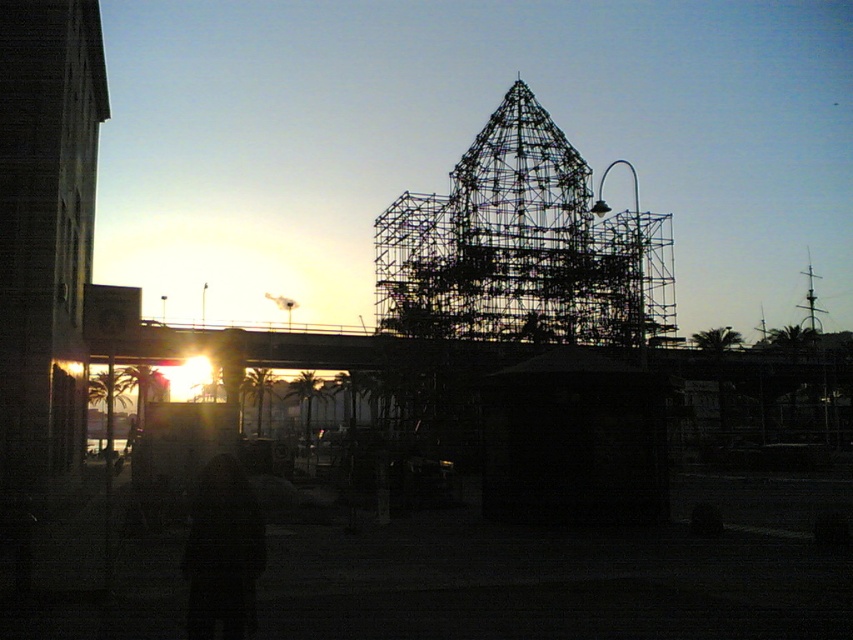
You are a photographer trying to capture the sunset through the metallic scaffolding at center and the dark fabric coat at lower center. Which object will block more of the sunset view due to its size?

The metallic scaffolding at center is bigger than the dark fabric coat at lower center, so it will block more of the sunset view.

You are standing on the bridge in the midground and want to walk to the metallic scaffolding at center and the dark fabric coat at lower center. Which object is closer to your current position?

The dark fabric coat at lower center is closer to your current position because the metallic scaffolding at center is to the right of it, meaning the coat is between you and the scaffolding.